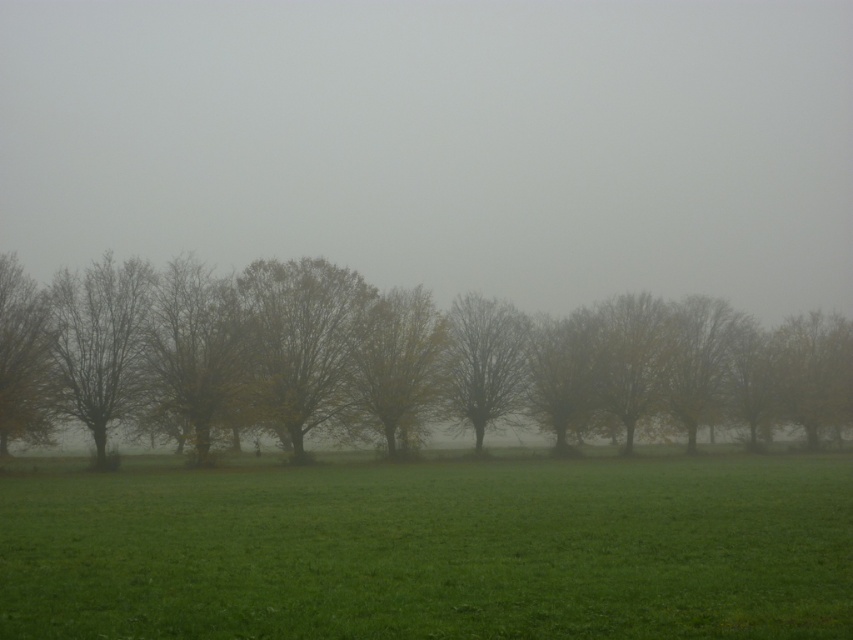
Between yellow-green foliage at center and bare branches at center, which one appears on the left side from the viewer's perspective?

yellow-green foliage at center

Identify the location of yellow-green foliage at center. (393, 364).

Image resolution: width=853 pixels, height=640 pixels. I want to click on yellow-green foliage at center, so click(393, 364).

Between green grassy field at center and brown leafy tree at center, which one appears on the left side from the viewer's perspective?

green grassy field at center

Does point (233, 625) come closer to viewer compared to point (801, 372)?

Yes, it is.

At what (x,y) coordinates should I click in order to perform the action: click on green grassy field at center. Please return your answer as a coordinate pair (x, y). The height and width of the screenshot is (640, 853). Looking at the image, I should click on (433, 550).

Can you confirm if yellow-green foliage at center is thinner than yellow-green foliage at left?

Incorrect, yellow-green foliage at center's width is not less than yellow-green foliage at left's.

Does yellow-green foliage at center have a lesser height compared to yellow-green foliage at left?

Yes.

The height and width of the screenshot is (640, 853). I want to click on yellow-green foliage at center, so click(x=393, y=364).